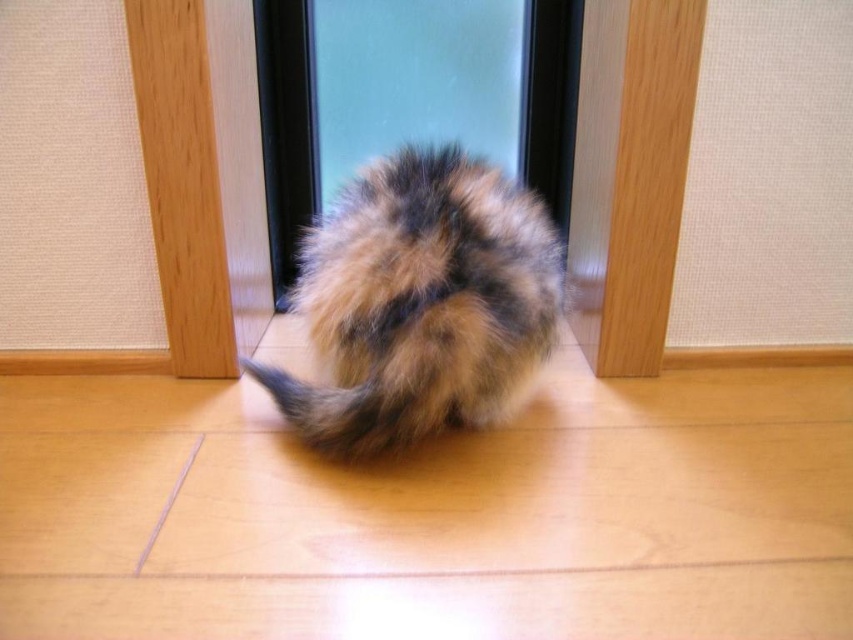
You are a drone operator trying to capture a photo of the fluffy fur cat at center. The drone is currently at the point marked as point (421, 301). Can you confirm if the drone is directly above the cat?

The point (421, 301) represents the fluffy fur cat at center, so yes, the drone is directly above the cat.

You are holding a camera and want to take a photo of the fluffy fur cat at center. The camera requires a minimum distance of 30 inches to focus properly. Can you take a clear photo from your current position?

The fluffy fur cat at center and camera are 31.48 inches apart, which is more than the required 30 inches. Therefore, you can take a clear photo from your current position.

You are a photographer trying to capture the fluffy fur cat at center through the transparent glass door at center. Considering their sizes, will the cat fit entirely within the frame of the door?

The fluffy fur cat at center is larger in size than the transparent glass door at center, so it will not fit entirely within the frame of the door.